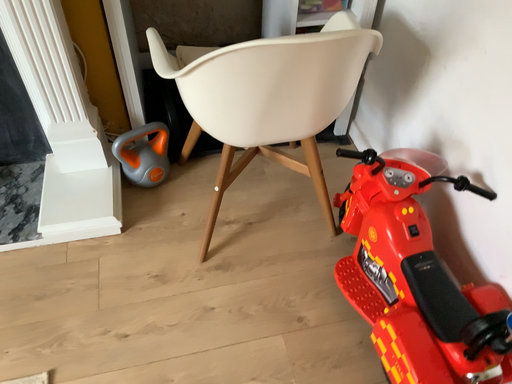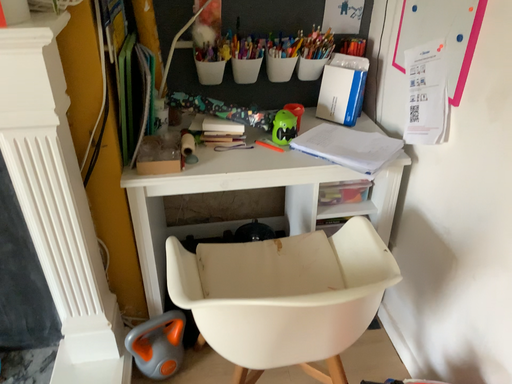
Question: Which way did the camera rotate in the video?

Choices:
 (A) rotated downward
 (B) rotated upward

Answer: (B)